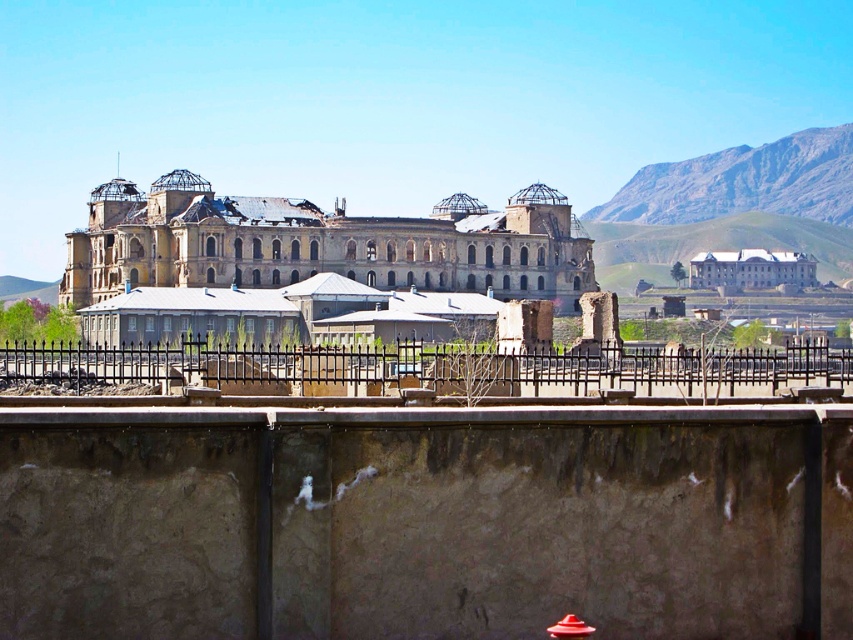
The width and height of the screenshot is (853, 640). Find the location of `black wrought iron fence at center`. black wrought iron fence at center is located at coordinates (415, 369).

Is point (816, 364) less distant than point (753, 288)?

Yes, it is.

At what (x,y) coordinates should I click in order to perform the action: click on black wrought iron fence at center. Please return your answer as a coordinate pair (x, y). Looking at the image, I should click on (415, 369).

Is weathered stone palace at center positioned in front of white smooth building at center?

That is True.

Between point (152, 186) and point (776, 282), which one is positioned in front?

Positioned in front is point (152, 186).

The image size is (853, 640). In order to click on weathered stone palace at center in this screenshot , I will do `click(321, 244)`.

The width and height of the screenshot is (853, 640). Identify the location of weathered stone palace at center. (321, 244).

Does weathered stone palace at center have a smaller size compared to black wrought iron fence at center?

Incorrect, weathered stone palace at center is not smaller in size than black wrought iron fence at center.

Who is more distant from viewer, (x=228, y=266) or (x=804, y=380)?

Positioned behind is point (x=228, y=266).

The width and height of the screenshot is (853, 640). Identify the location of weathered stone palace at center. (321, 244).